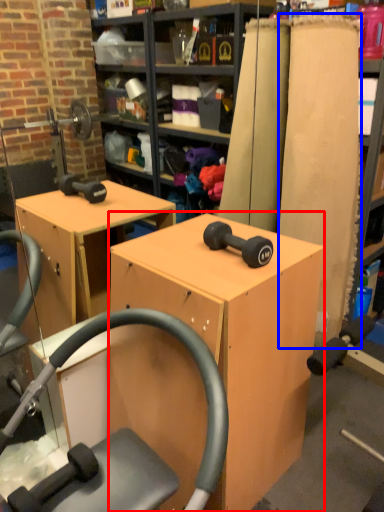
Question: Which of the following is the farthest to the observer, furniture (highlighted by a red box) or plank (highlighted by a blue box)?

Choices:
 (A) furniture
 (B) plank

Answer: (B)